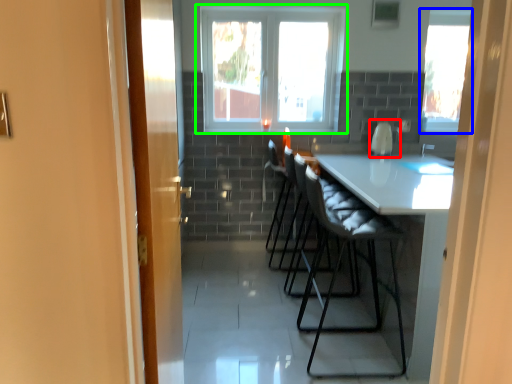
Question: Based on their relative distances, which object is nearer to appliance (highlighted by a red box)? Choose from window (highlighted by a blue box) and window (highlighted by a green box).

Choices:
 (A) window
 (B) window

Answer: (A)